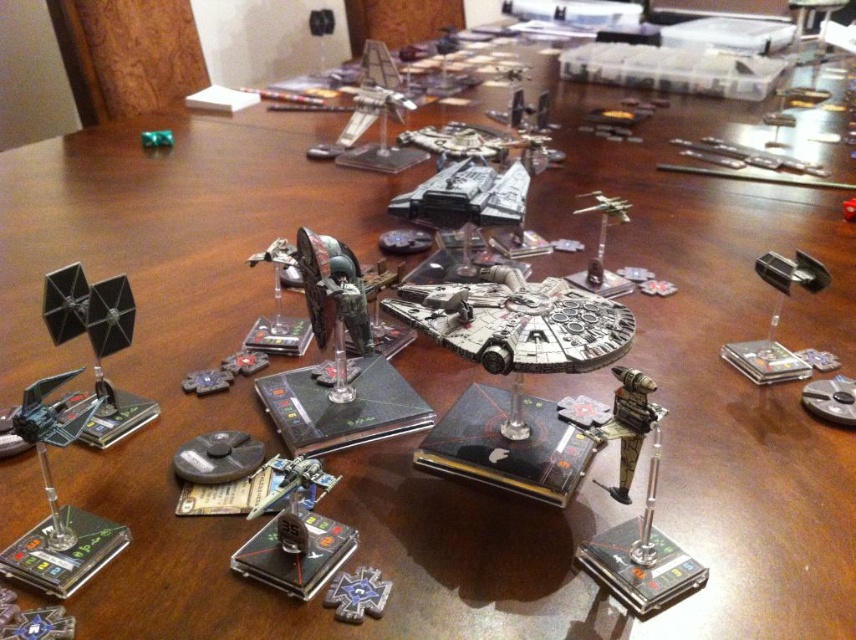
Is the position of metallic silver star at center more distant than that of metallic silver starfighter at upper right?

No, it is in front of metallic silver starfighter at upper right.

Is point (360, 592) positioned in front of point (599, 280)?

Yes, it is in front of point (599, 280).

The height and width of the screenshot is (640, 856). Find the location of `metallic silver star at center`. metallic silver star at center is located at coordinates (357, 595).

Can you confirm if metallic silver spaceship at lower left is shorter than metallic silver star at center?

No.

This screenshot has height=640, width=856. Identify the location of metallic silver spaceship at lower left. (51, 442).

Locate an element on the screen. The width and height of the screenshot is (856, 640). metallic silver spaceship at lower left is located at coordinates (51, 442).

In order to click on metallic silver spaceship at lower left in this screenshot , I will do `click(51, 442)`.

Is metallic silver spaceship at lower left taller than metallic silver starfighter at upper right?

Incorrect, metallic silver spaceship at lower left's height is not larger of metallic silver starfighter at upper right's.

Does metallic silver spaceship at lower left have a lesser width compared to metallic silver starfighter at upper right?

No, metallic silver spaceship at lower left is not thinner than metallic silver starfighter at upper right.

Who is more forward, (46, 419) or (599, 250)?

Point (46, 419)

Find the location of a particular element. This screenshot has width=856, height=640. metallic silver spaceship at lower left is located at coordinates (51, 442).